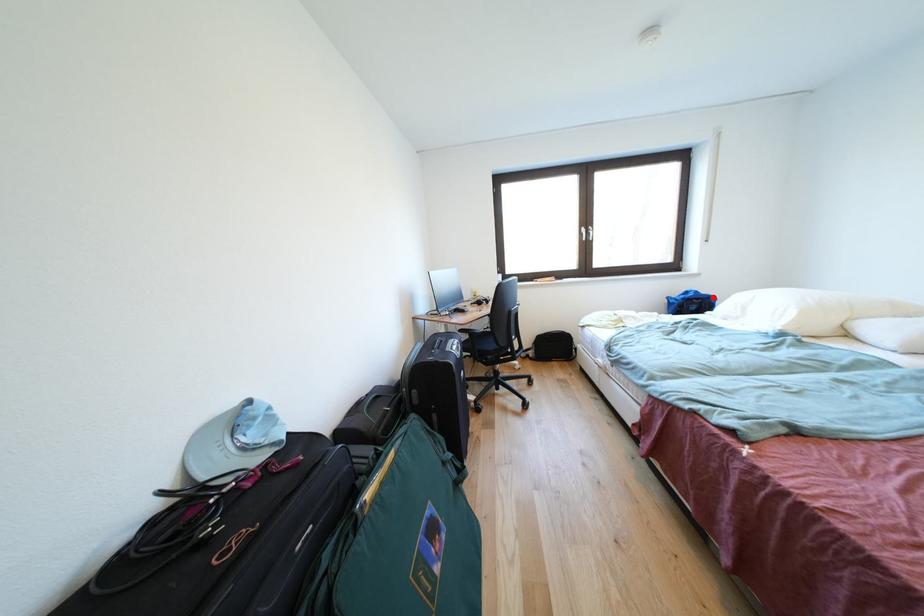
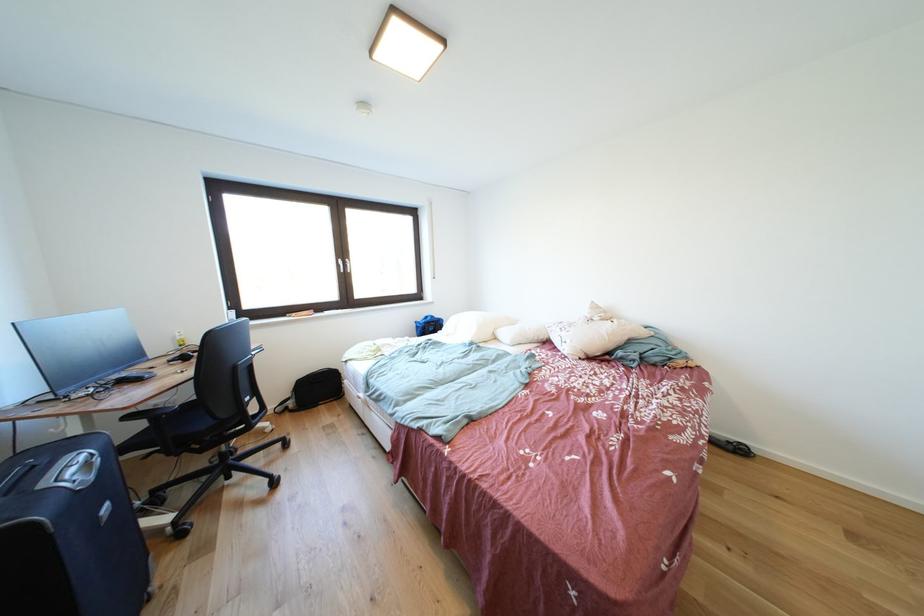
The point at the highlighted location is marked in the first image. Where is the corresponding point in the second image?

(445, 321)